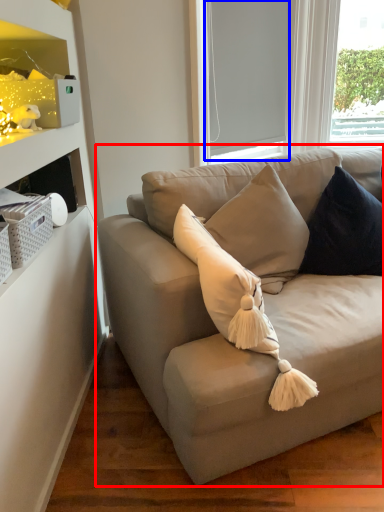
Question: Which of the following is the closest to the observer, studio couch (highlighted by a red box) or window screen (highlighted by a blue box)?

Choices:
 (A) studio couch
 (B) window screen

Answer: (A)